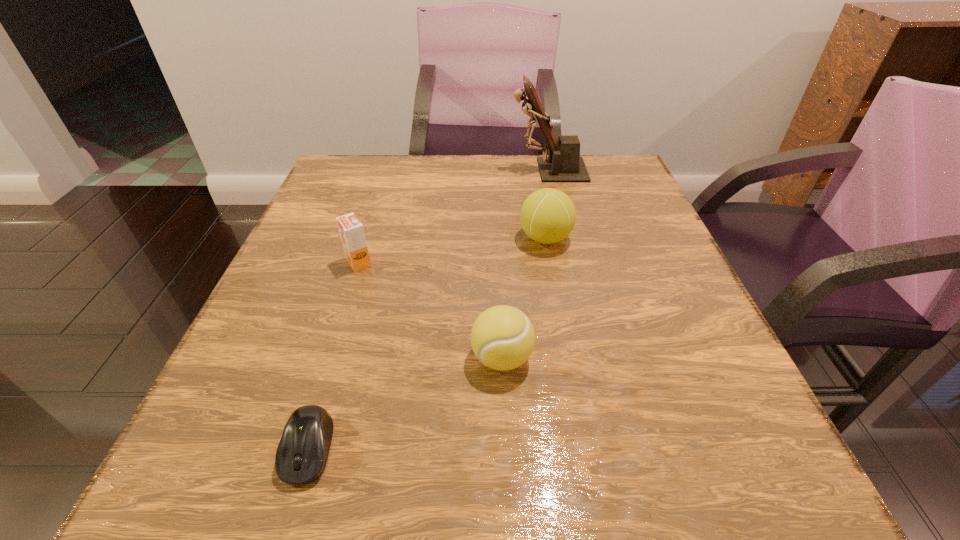
At what (x,y) coordinates should I click in order to perform the action: click on object at the far right corner. Please return your answer as a coordinate pair (x, y). This screenshot has height=540, width=960. Looking at the image, I should click on (563, 164).

This screenshot has width=960, height=540. Identify the location of vacant space at the far edge. (415, 177).

Find the location of a particular element. The image size is (960, 540). vacant space at the near edge of the desktop is located at coordinates (637, 482).

At what (x,y) coordinates should I click in order to perform the action: click on blank space at the left edge. Please return your answer as a coordinate pair (x, y). Looking at the image, I should click on (299, 333).

You are a GUI agent. You are given a task and a screenshot of the screen. Output one action in this format:
    pyautogui.click(x=<x>, y=<y>)
    Task: Click on the blank area at the right edge
    The height and width of the screenshot is (540, 960).
    Given the screenshot: What is the action you would take?
    pyautogui.click(x=736, y=381)

The height and width of the screenshot is (540, 960). What are the coordinates of `blank space at the far left corner` in the screenshot? It's located at (374, 190).

You are a GUI agent. You are given a task and a screenshot of the screen. Output one action in this format:
    pyautogui.click(x=<x>, y=<y>)
    Task: Click on the free space between the orange juice and the second nearest object
    The width and height of the screenshot is (960, 540).
    Given the screenshot: What is the action you would take?
    pyautogui.click(x=430, y=310)

At what (x,y) coordinates should I click in order to perform the action: click on free space between the second nearest object and the nearest object. Please return your answer as a coordinate pair (x, y). The width and height of the screenshot is (960, 540). Looking at the image, I should click on (405, 403).

The width and height of the screenshot is (960, 540). What are the coordinates of `free space between the orange juice and the second nearest object` in the screenshot? It's located at (430, 310).

Find the location of a particular element. The image size is (960, 540). free spot between the farther tennis ball and the nearer tennis ball is located at coordinates (523, 298).